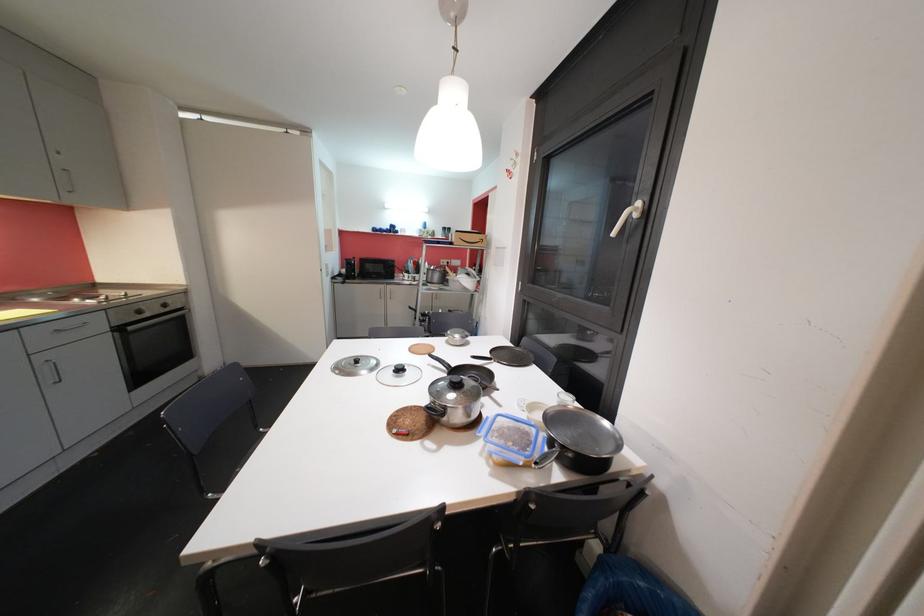
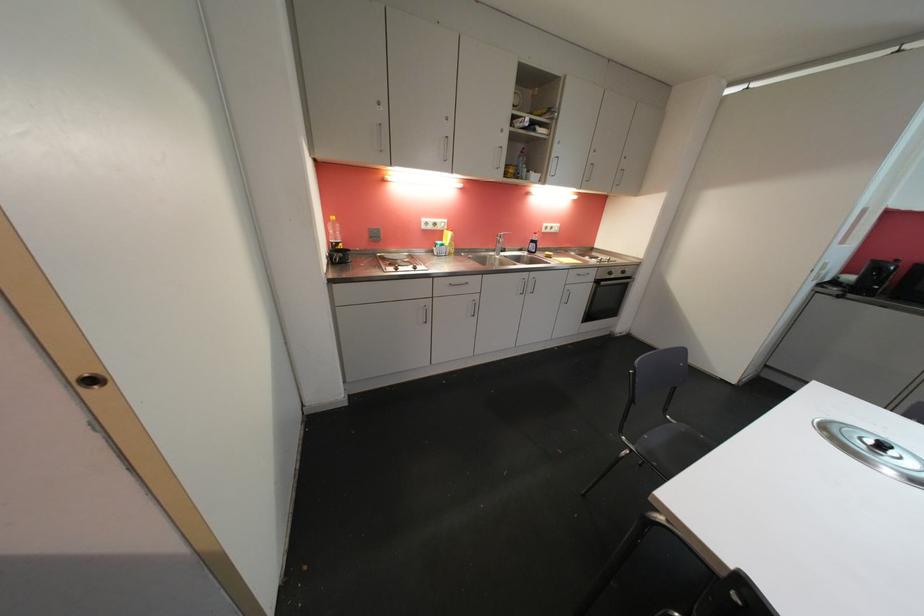
The first image is from the beginning of the video and the second image is from the end. How did the camera likely rotate when shooting the video?

The camera rotated toward left-down.